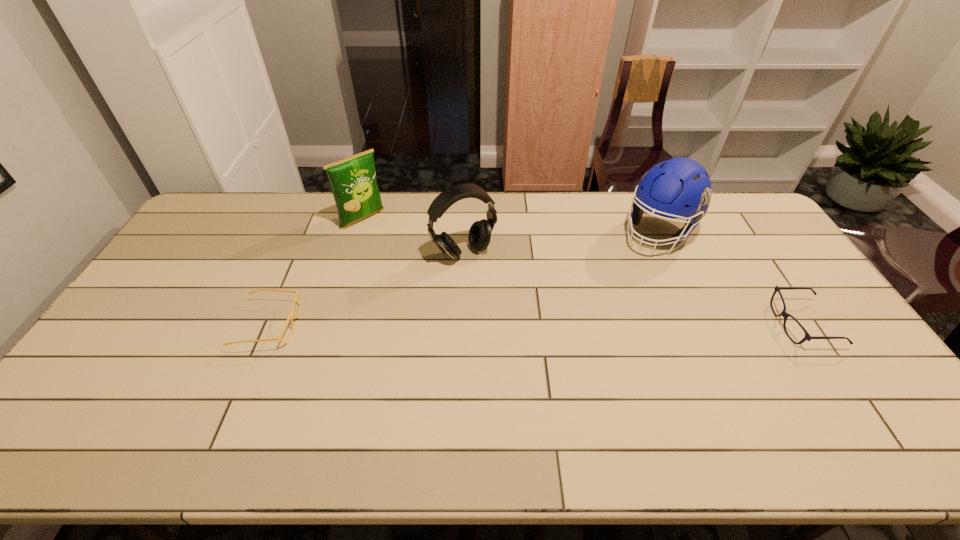
The width and height of the screenshot is (960, 540). I want to click on vacant space on the desktop that is between the leftmost object and the rightmost object and is positioned on the ear cups of the earphone, so click(515, 325).

You are a GUI agent. You are given a task and a screenshot of the screen. Output one action in this format:
    pyautogui.click(x=<x>, y=<y>)
    Task: Click on the vacant spot on the desktop that is between the left spectacles and the rightmost object and is positioned on the front-facing side of the fourth object from left to right
    
    Given the screenshot: What is the action you would take?
    pyautogui.click(x=575, y=325)

Find the location of `free spot on the desktop that is between the left spectacles and the rightmost object and is positioned on the front-facing side of the crisp (potato chip)`. free spot on the desktop that is between the left spectacles and the rightmost object and is positioned on the front-facing side of the crisp (potato chip) is located at coordinates (477, 325).